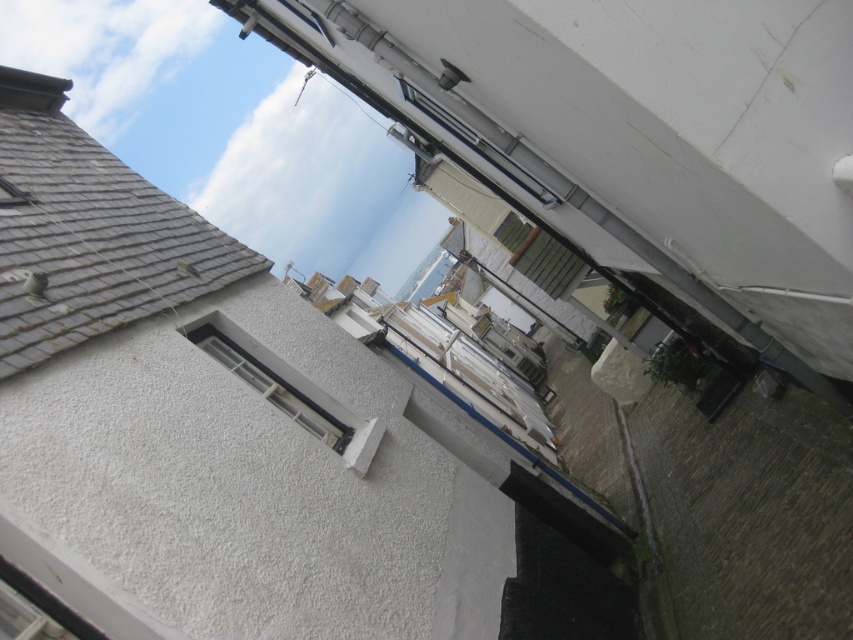
Can you confirm if gray shingles at upper left is positioned to the right of white textured window at upper center?

No, gray shingles at upper left is not to the right of white textured window at upper center.

Between point (30, 80) and point (251, 362), which one is positioned in front?

Point (251, 362) is in front.

Who is more distant from viewer, (10, 122) or (331, 419)?

The point (10, 122) is more distant.

At what (x,y) coordinates should I click in order to perform the action: click on gray shingles at upper left. Please return your answer as a coordinate pair (x, y). Looking at the image, I should click on (88, 234).